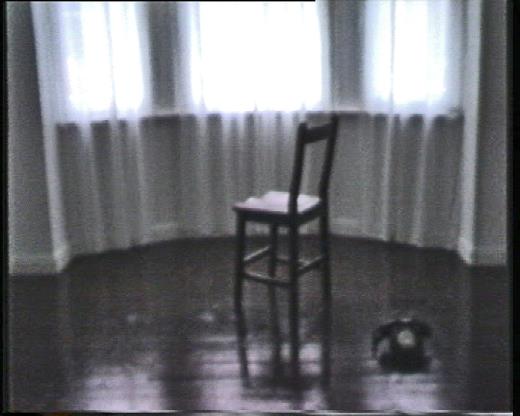
At what (x,y) coordinates should I click in order to perform the action: click on seat. Please return your answer as a coordinate pair (x, y). The width and height of the screenshot is (520, 416). Looking at the image, I should click on (273, 201).